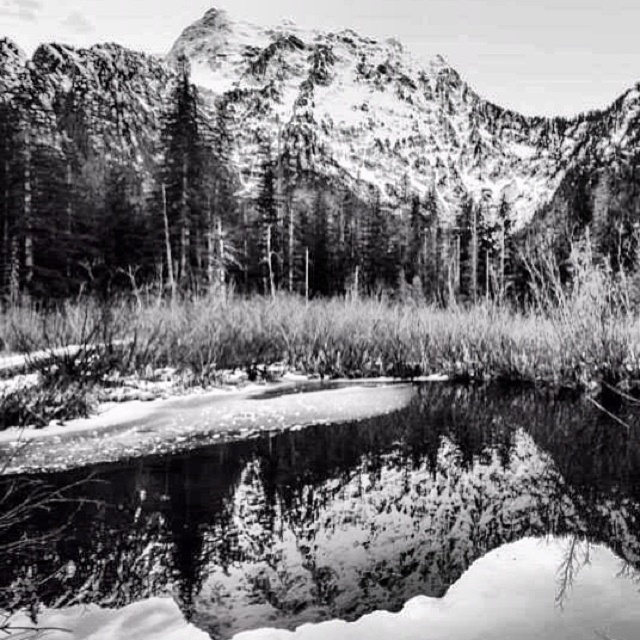
Does rugged stone mountain at upper center come behind smooth ice at center?

Yes.

Is rugged stone mountain at upper center wider than smooth ice at center?

Yes.

Which is behind, point (22, 179) or point (406, 452)?

Positioned behind is point (22, 179).

Image resolution: width=640 pixels, height=640 pixels. What are the coordinates of `rugged stone mountain at upper center` in the screenshot? It's located at (291, 168).